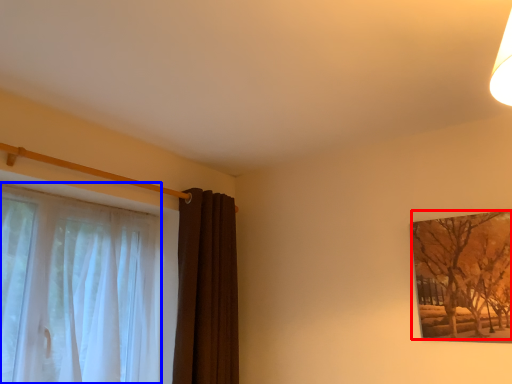
Question: Which object is closer to the camera taking this photo, tree (highlighted by a red box) or curtain (highlighted by a blue box)?

Choices:
 (A) tree
 (B) curtain

Answer: (B)